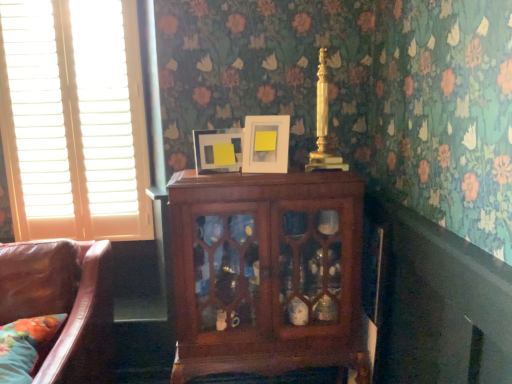
Question: Is matte white picture frame at center, the first picture frame when ordered from left to right, facing towards floral fabric pillow at lower left?

Choices:
 (A) no
 (B) yes

Answer: (A)

Question: From the image's perspective, is matte white picture frame at center, arranged as the 2th picture frame when viewed from the right, on floral fabric pillow at lower left?

Choices:
 (A) no
 (B) yes

Answer: (B)

Question: Is matte white picture frame at center, the first picture frame when ordered from left to right, thinner than floral fabric pillow at lower left?

Choices:
 (A) no
 (B) yes

Answer: (B)

Question: From a real-world perspective, is matte white picture frame at center, the first picture frame when ordered from left to right, positioned over floral fabric pillow at lower left based on gravity?

Choices:
 (A) no
 (B) yes

Answer: (B)

Question: Would you say floral fabric pillow at lower left is part of matte white picture frame at center, arranged as the 2th picture frame when viewed from the right,'s contents?

Choices:
 (A) yes
 (B) no

Answer: (B)

Question: Does matte white picture frame at center, arranged as the 2th picture frame when viewed from the right, have a lesser height compared to floral fabric pillow at lower left?

Choices:
 (A) yes
 (B) no

Answer: (A)

Question: Is white wood blinds at left to the left of floral fabric pillow at lower left from the viewer's perspective?

Choices:
 (A) no
 (B) yes

Answer: (B)

Question: From a real-world perspective, is white wood blinds at left located beneath floral fabric pillow at lower left?

Choices:
 (A) yes
 (B) no

Answer: (B)

Question: Is white wood blinds at left not inside floral fabric pillow at lower left?

Choices:
 (A) no
 (B) yes

Answer: (B)

Question: Is floral fabric pillow at lower left located within white wood blinds at left?

Choices:
 (A) no
 (B) yes

Answer: (A)

Question: Is white wood blinds at left not close to floral fabric pillow at lower left?

Choices:
 (A) yes
 (B) no

Answer: (B)

Question: From a real-world perspective, is white wood blinds at left on top of floral fabric pillow at lower left?

Choices:
 (A) yes
 (B) no

Answer: (A)

Question: From the image's perspective, is matte white picture frame at upper center, which is counted as the 1th picture frame, starting from the right, under mahogany cabinet at center?

Choices:
 (A) yes
 (B) no

Answer: (B)